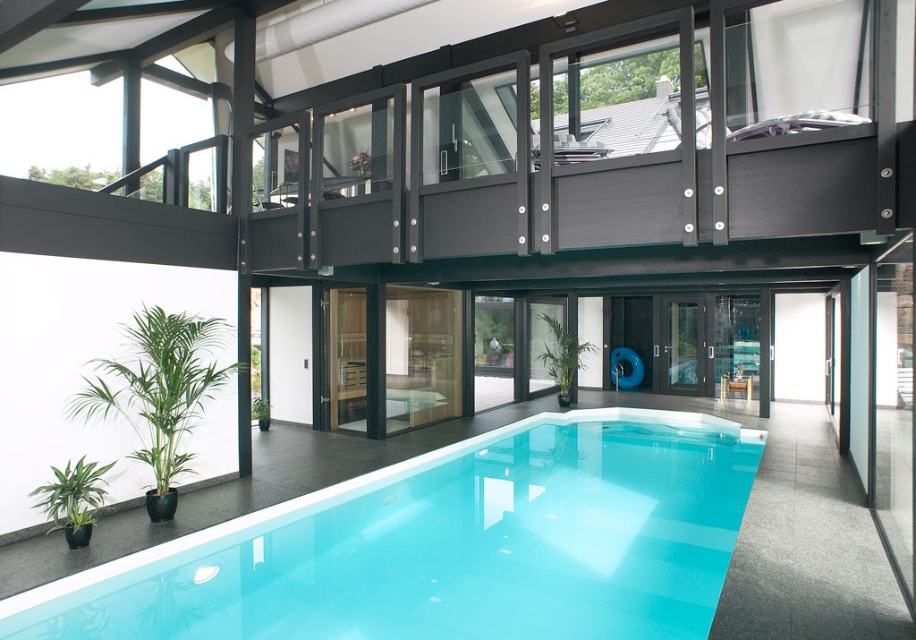
Looking at this image, you are standing in the pool area and want to place a small bench between the clear acrylic pool at lower center and the green glossy plant at lower left. Based on their positions, which object should the bench be closer to?

The bench should be placed closer to the green glossy plant at lower left since the clear acrylic pool at lower center is positioned to the right of it.

You are a guest at this modern house and want to place a large potted fern next to the green leafy plant at lower left without blocking the view of the clear acrylic pool at lower center. Based on their sizes, is this possible?

The clear acrylic pool at lower center might be wider than the green leafy plant at lower left, so placing a large potted fern next to the green leafy plant at lower left could potentially block the view of the clear acrylic pool at lower center if the combined size exceeds the available space.